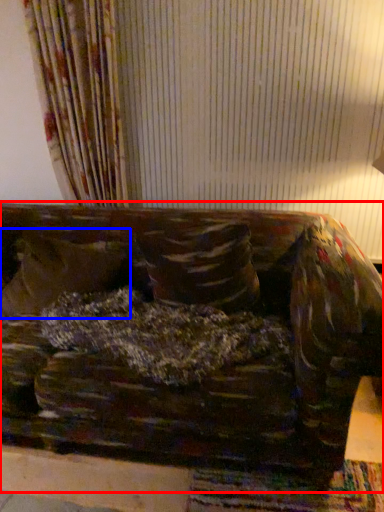
Question: Among these objects, which one is farthest to the camera, studio couch (highlighted by a red box) or pillow (highlighted by a blue box)?

Choices:
 (A) studio couch
 (B) pillow

Answer: (B)